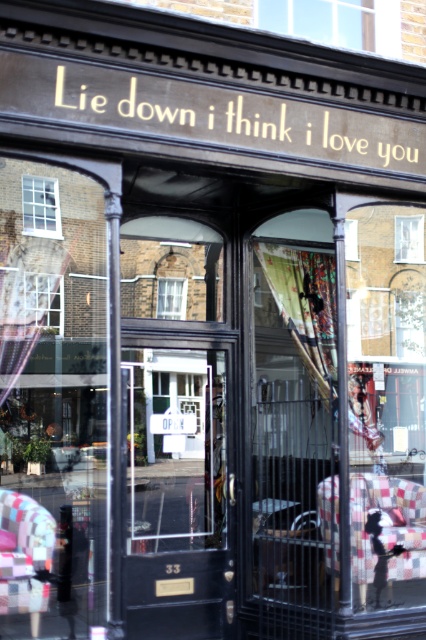
You are a delivery person trying to see inside the store through the windows. Which window, the transparent glass window at center or the clear glass window at center, allows you to see the most of the store interior?

The transparent glass window at center is much taller than the clear glass window at center, so it allows you to see more of the store interior.

You are a delivery person trying to see the sign on the store entrance. Which of the two clear glass windows, the clear glass window at upper center or the clear glass window at upper left, offers a better view of the sign?

The clear glass window at upper center offers a better view of the sign because it is bigger than the clear glass window at upper left.